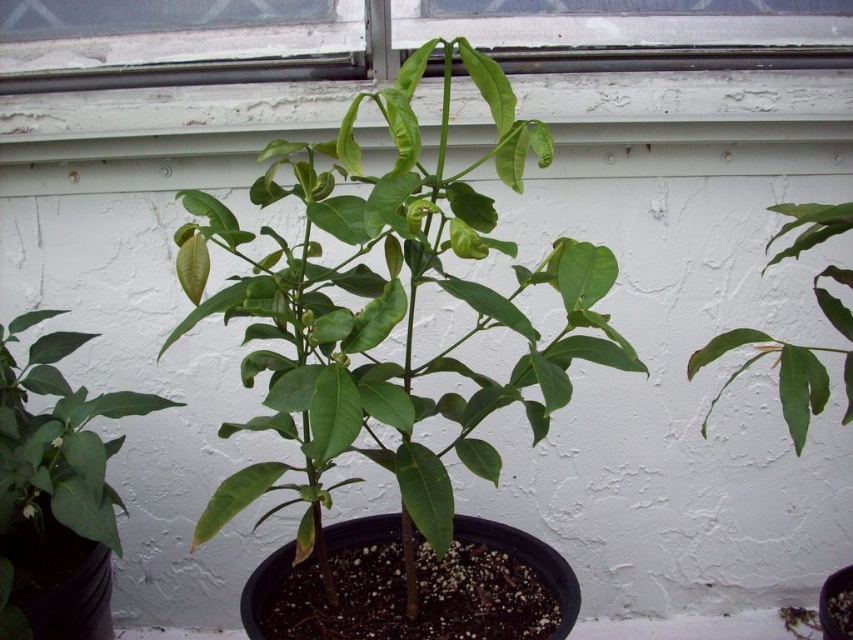
Is green glossy leaf at center shorter than green glossy leaf at upper right?

Incorrect, green glossy leaf at center's height does not fall short of green glossy leaf at upper right's.

Which of these two, green glossy leaf at center or green glossy leaf at upper right, stands taller?

With more height is green glossy leaf at center.

This screenshot has width=853, height=640. I want to click on green glossy leaf at center, so [51, 461].

Does green glossy leafy plant at center lie behind green glossy leaf at center?

No, green glossy leafy plant at center is closer to the viewer.

Is green glossy leafy plant at center closer to camera compared to green glossy leaf at center?

Yes, green glossy leafy plant at center is closer to the viewer.

You are a GUI agent. You are given a task and a screenshot of the screen. Output one action in this format:
    pyautogui.click(x=<x>, y=<y>)
    Task: Click on the green glossy leafy plant at center
    This screenshot has height=640, width=853.
    Given the screenshot: What is the action you would take?
    pyautogui.click(x=387, y=310)

The height and width of the screenshot is (640, 853). Find the location of `green glossy leafy plant at center`. green glossy leafy plant at center is located at coordinates (387, 310).

Measure the distance between green glossy leafy plant at center and green glossy leaf at upper right.

green glossy leafy plant at center and green glossy leaf at upper right are 20.08 inches apart from each other.

Is point (257, 472) closer to camera compared to point (722, 342)?

Yes, point (257, 472) is closer to viewer.

At what (x,y) coordinates should I click in order to perform the action: click on green glossy leafy plant at center. Please return your answer as a coordinate pair (x, y). This screenshot has height=640, width=853. Looking at the image, I should click on (387, 310).